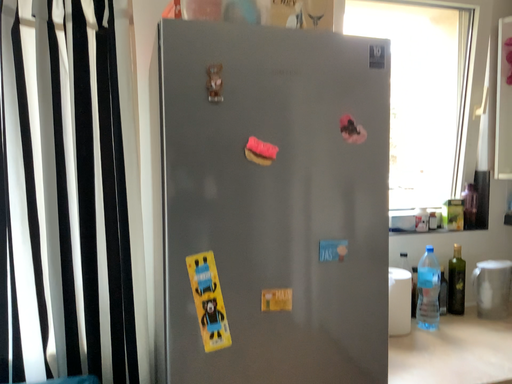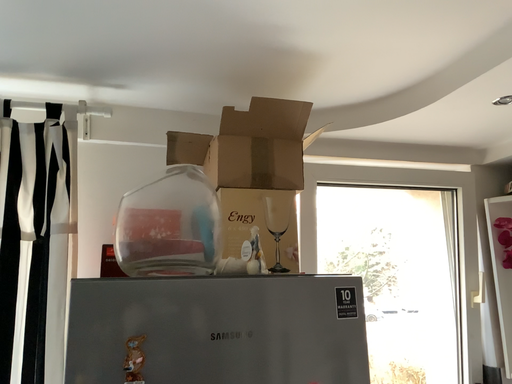
Question: Which way did the camera rotate in the video?

Choices:
 (A) rotated downward
 (B) rotated upward

Answer: (B)